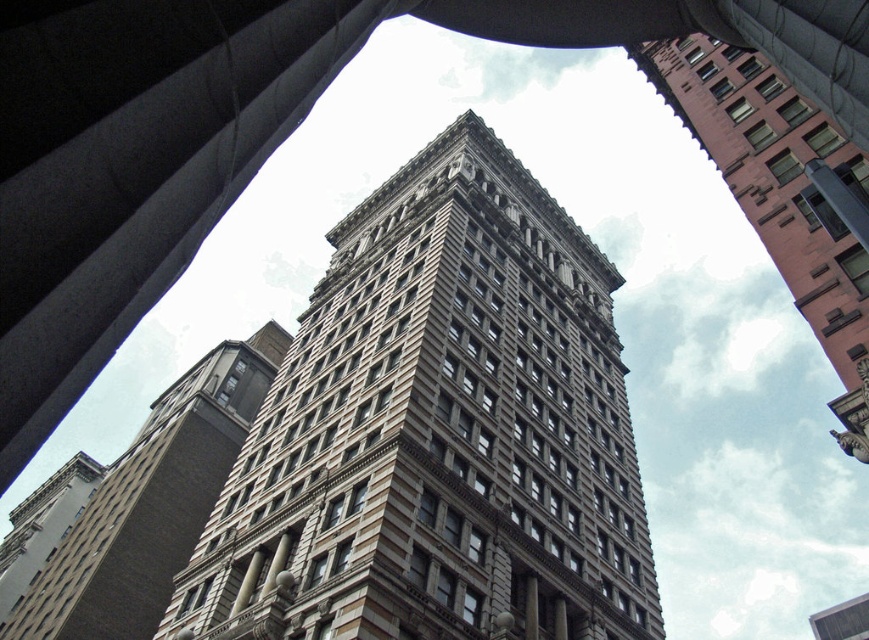
You are an architect analyzing the facade of the two buildings in the image. Which building has a larger width between the brown stone building at center and the pink brick building at upper right?

The brown stone building at center has a larger width compared to the pink brick building at upper right.

You are standing in front of the historic building and want to take a photo that includes both the brown stone tower at center and the brown stone building at center. Which one of these objects is positioned closer to you, and why?

The brown stone tower at center is closer to the viewer than the brown stone building at center because it is described as being in front of or nearer in the spatial arrangement.

You are an architect analyzing two buildings in the city. You see the brown stone building at center and the pink brick building at upper right. Which building has a greater height?

The brown stone building at center is much taller than the pink brick building at upper right.